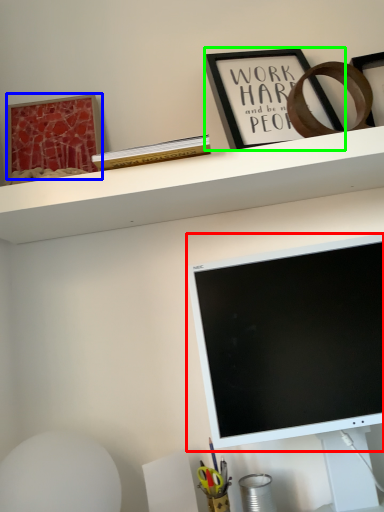
Question: Considering the real-world distances, which object is farthest from computer monitor (highlighted by a red box)? picture frame (highlighted by a blue box) or picture frame (highlighted by a green box)?

Choices:
 (A) picture frame
 (B) picture frame

Answer: (A)